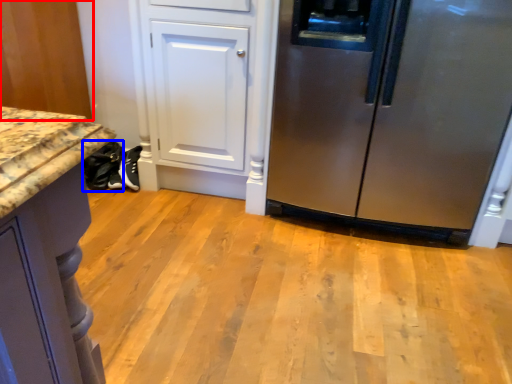
Question: Which point is closer to the camera, cabinetry (highlighted by a red box) or footwear (highlighted by a blue box)?

Choices:
 (A) cabinetry
 (B) footwear

Answer: (A)